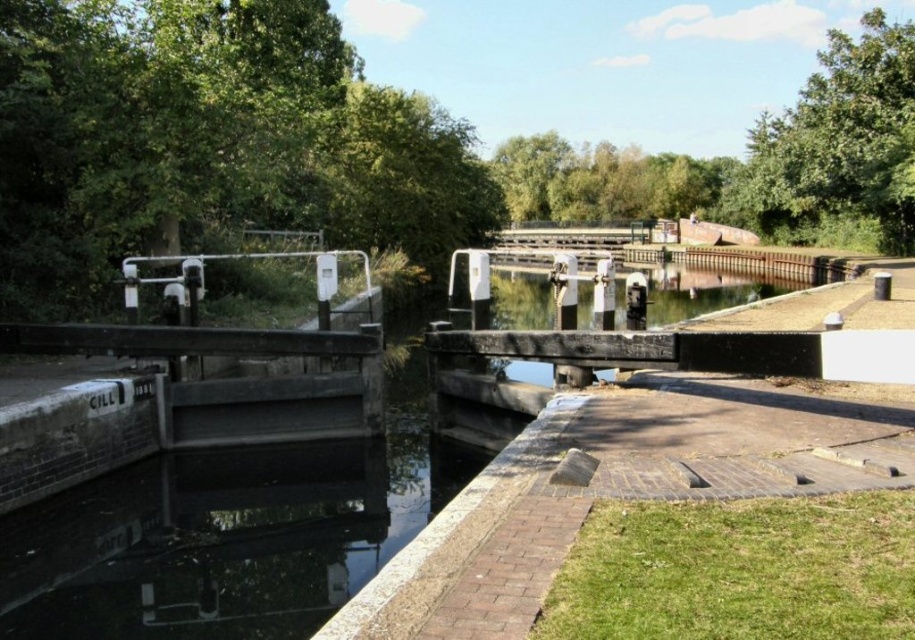
You are a photographer planning to take a symmetrical shot of the canal lock with both the green leafy tree at upper left and the green leafy tree at upper right in the frame. Considering their sizes, which tree would appear closer to the center of the photo?

The green leafy tree at upper left is smaller in size compared to the green leafy tree at upper right. Since the smaller tree is at the upper left and the larger one is at the upper right, to maintain symmetry, the smaller tree at upper left would need to be positioned closer to the center to balance the composition, making it appear closer to the center in the photo.

You are a photographer standing at the edge of the canal lock system. You want to take a photo that includes both point (203, 173) and point (572, 154). Which point will appear larger in your photo?

Point (203, 173) is closer to the camera than point (572, 154), so it will appear larger in the photo.

You are a photographer planning to take a picture of the canal lock system. You want to frame both the green leafy tree at upper left and the green leafy tree at upper center in your shot. Which tree should you position closer to the left edge of your camera frame?

You should position the green leafy tree at upper left closer to the left edge of your camera frame because it is located to the left of the green leafy tree at upper center.